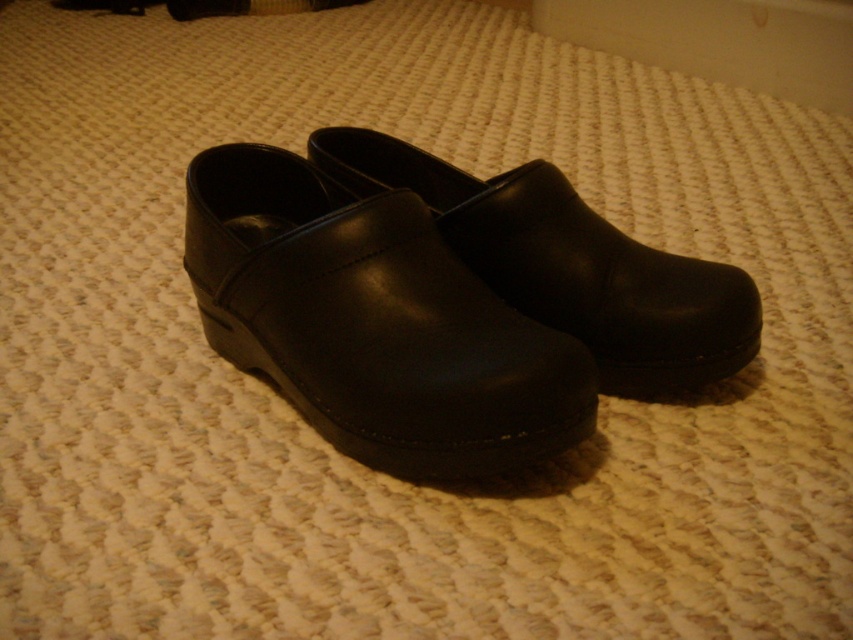
You are standing in a room and see the black leather clogs at center and the black leather clog at center. Which one is positioned lower?

The black leather clogs at center is located below the black leather clog at center, so the black leather clogs at center is positioned lower.

You are trying to determine the position of the two black leather clogs. According to the image, which one is closer to you between the black leather clogs at center and the black leather clog at center?

The black leather clogs at center is closer to you because it is in front of the black leather clog at center.